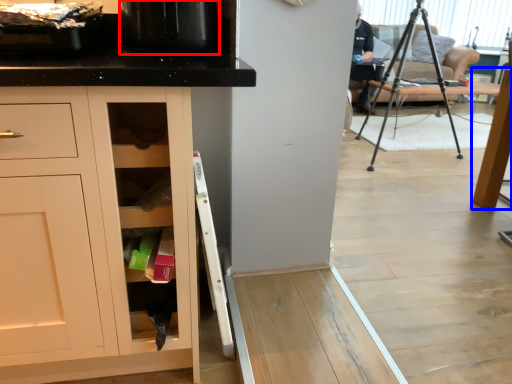
Question: Among these objects, which one is nearest to the camera, appliance (highlighted by a red box) or table (highlighted by a blue box)?

Choices:
 (A) appliance
 (B) table

Answer: (A)